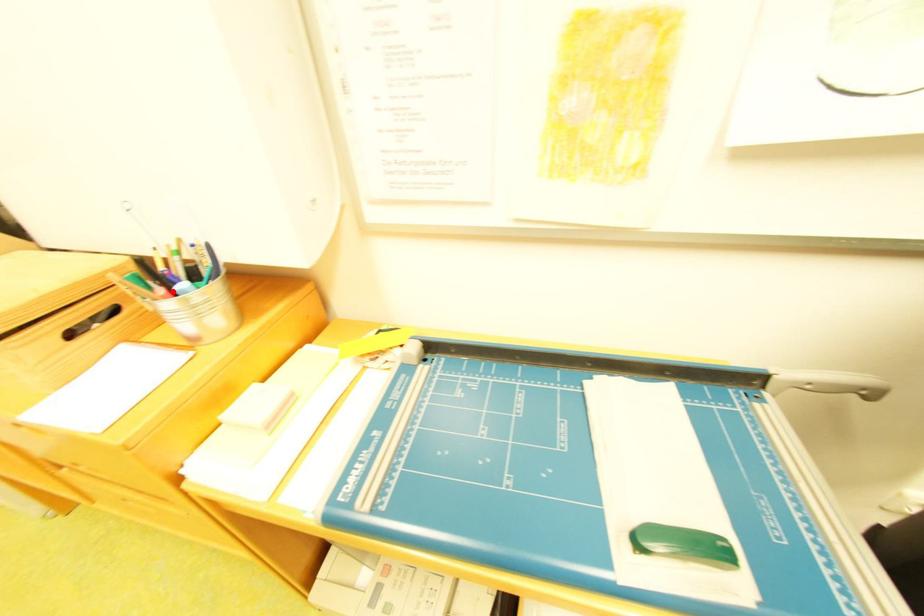
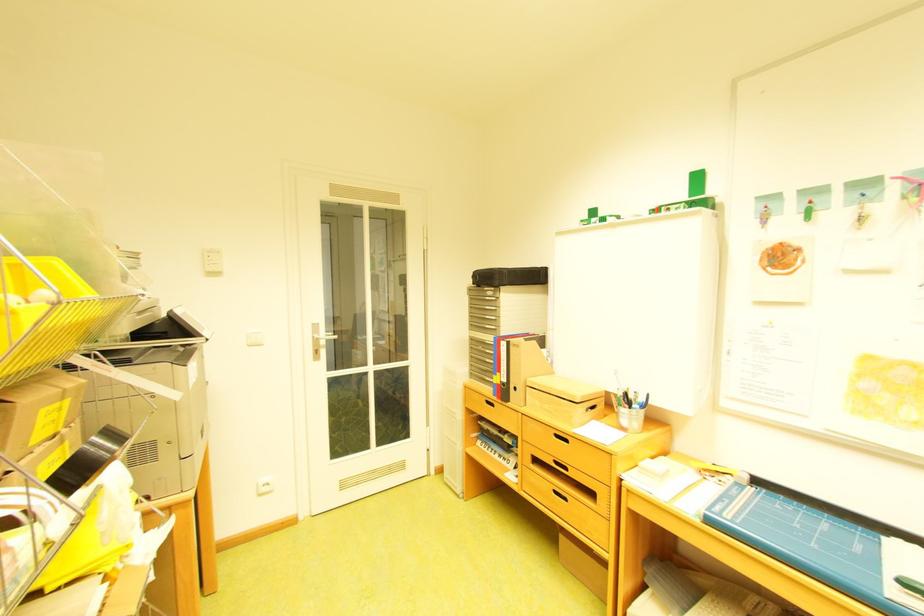
Locate, in the second image, the point that corresponds to the highlighted location in the first image.

(638, 407)